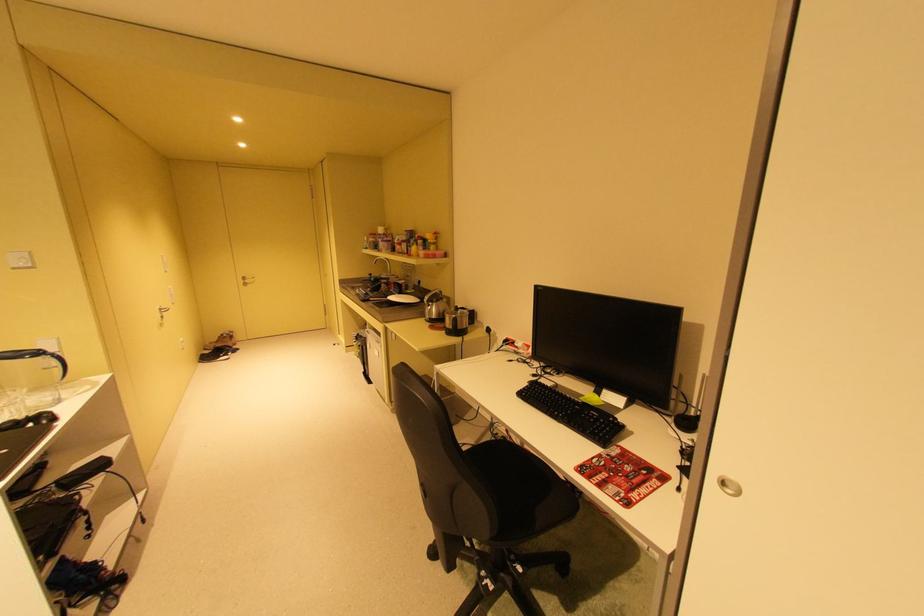
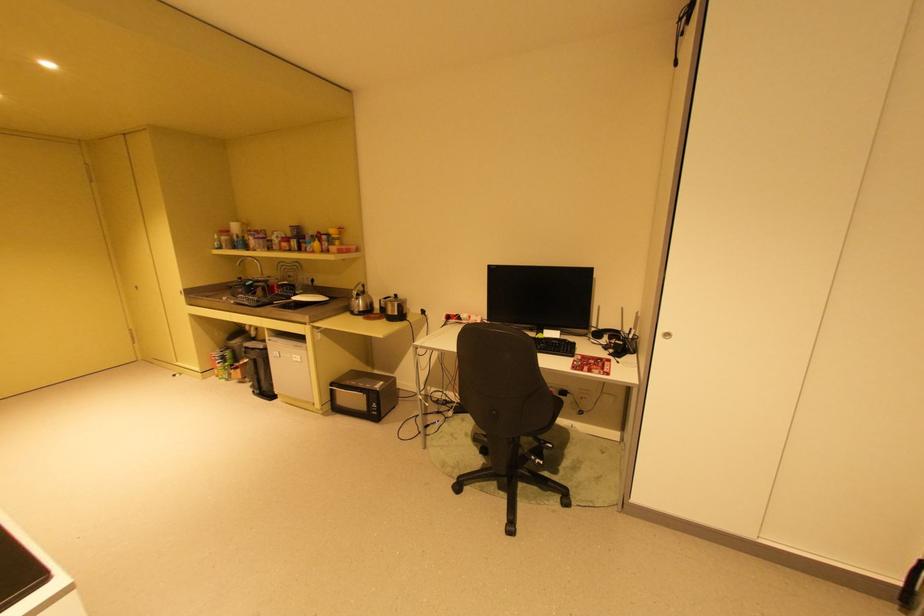
In the second image, find the point that corresponds to (x=460, y=328) in the first image.

(404, 314)